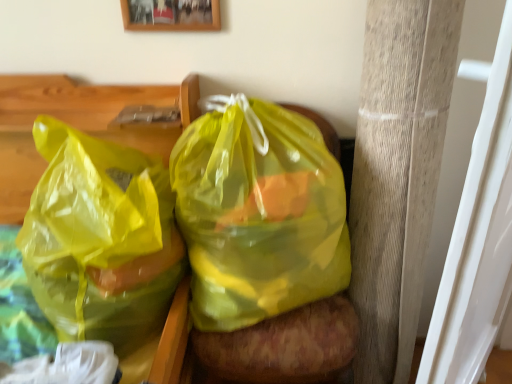
Where is `translucent yellow plastic bag at center, which appears as the 2th plastic bag when viewed from the left`? This screenshot has width=512, height=384. translucent yellow plastic bag at center, which appears as the 2th plastic bag when viewed from the left is located at coordinates (259, 215).

Is point (208, 315) behind point (155, 274)?

Yes, it is behind point (155, 274).

Looking at this image, from a real-world perspective, who is located higher, translucent yellow plastic bag at center, which appears as the 2th plastic bag when viewed from the left, or translucent yellow plastic bag at left, arranged as the first plastic bag when viewed from the left?

translucent yellow plastic bag at center, which appears as the 2th plastic bag when viewed from the left.

Is translucent yellow plastic bag at center, the 1th plastic bag viewed from the right, smaller than translucent yellow plastic bag at left, arranged as the first plastic bag when viewed from the left?

Correct, translucent yellow plastic bag at center, the 1th plastic bag viewed from the right, occupies less space than translucent yellow plastic bag at left, arranged as the first plastic bag when viewed from the left.

From the image's perspective, relative to translucent yellow plastic bag at left, arranged as the first plastic bag when viewed from the left, is translucent yellow plastic bag at center, which appears as the 2th plastic bag when viewed from the left, above or below?

From the image's perspective, translucent yellow plastic bag at center, which appears as the 2th plastic bag when viewed from the left, appears above translucent yellow plastic bag at left, arranged as the first plastic bag when viewed from the left.

Considering the relative sizes of translucent yellow plastic bag at left, positioned as the 2th plastic bag in right-to-left order, and wooden picture frame at upper center in the image provided, is translucent yellow plastic bag at left, positioned as the 2th plastic bag in right-to-left order, bigger than wooden picture frame at upper center?

Indeed, translucent yellow plastic bag at left, positioned as the 2th plastic bag in right-to-left order, has a larger size compared to wooden picture frame at upper center.

Between translucent yellow plastic bag at left, arranged as the first plastic bag when viewed from the left, and wooden picture frame at upper center, which one has more height?

translucent yellow plastic bag at left, arranged as the first plastic bag when viewed from the left.

In the scene shown: Is translucent yellow plastic bag at left, arranged as the first plastic bag when viewed from the left, wider than wooden picture frame at upper center?

Correct, the width of translucent yellow plastic bag at left, arranged as the first plastic bag when viewed from the left, exceeds that of wooden picture frame at upper center.

From the image's perspective, relative to wooden pillar at right, is translucent yellow plastic bag at center, which appears as the 2th plastic bag when viewed from the left, above or below?

Clearly, from the image's perspective, translucent yellow plastic bag at center, which appears as the 2th plastic bag when viewed from the left, is above wooden pillar at right.

Is point (344, 236) farther from viewer compared to point (429, 108)?

Yes, it is behind point (429, 108).

Is wooden pillar at right surrounded by translucent yellow plastic bag at center, which appears as the 2th plastic bag when viewed from the left?

No, wooden pillar at right is not surrounded by translucent yellow plastic bag at center, which appears as the 2th plastic bag when viewed from the left.

Based on the photo, is translucent yellow plastic bag at center, which appears as the 2th plastic bag when viewed from the left, looking in the opposite direction of wooden pillar at right?

translucent yellow plastic bag at center, which appears as the 2th plastic bag when viewed from the left, is not turned away from wooden pillar at right.

From a real-world perspective, is translucent yellow plastic bag at left, arranged as the first plastic bag when viewed from the left, physically located above or below wooden pillar at right?

translucent yellow plastic bag at left, arranged as the first plastic bag when viewed from the left, is below wooden pillar at right.

Image resolution: width=512 pixels, height=384 pixels. I want to click on pillar on the right of translucent yellow plastic bag at left, arranged as the first plastic bag when viewed from the left, so click(398, 173).

Which is behind, point (123, 339) or point (372, 7)?

The point (123, 339) is behind.

Is translucent yellow plastic bag at left, positioned as the 2th plastic bag in right-to-left order, in contact with wooden pillar at right?

No, translucent yellow plastic bag at left, positioned as the 2th plastic bag in right-to-left order, is not beside wooden pillar at right.

In the scene shown: Which is in front, translucent yellow plastic bag at left, positioned as the 2th plastic bag in right-to-left order, or translucent yellow plastic bag at center, the 1th plastic bag viewed from the right?

translucent yellow plastic bag at left, positioned as the 2th plastic bag in right-to-left order, is more forward.

Find the location of a particular element. Image resolution: width=512 pixels, height=384 pixels. plastic bag above the translucent yellow plastic bag at left, positioned as the 2th plastic bag in right-to-left order (from a real-world perspective) is located at coordinates (259, 215).

Is translucent yellow plastic bag at center, the 1th plastic bag viewed from the right, completely or partially inside translucent yellow plastic bag at left, positioned as the 2th plastic bag in right-to-left order?

No, translucent yellow plastic bag at center, the 1th plastic bag viewed from the right, is not surrounded by translucent yellow plastic bag at left, positioned as the 2th plastic bag in right-to-left order.

From the image's perspective, is translucent yellow plastic bag at left, arranged as the first plastic bag when viewed from the left, above or below translucent yellow plastic bag at center, the 1th plastic bag viewed from the right?

translucent yellow plastic bag at left, arranged as the first plastic bag when viewed from the left, is situated lower than translucent yellow plastic bag at center, the 1th plastic bag viewed from the right, in the image.

Is wooden pillar at right far away from translucent yellow plastic bag at left, positioned as the 2th plastic bag in right-to-left order?

They are positioned close to each other.

Does wooden pillar at right have a larger size compared to translucent yellow plastic bag at left, positioned as the 2th plastic bag in right-to-left order?

Actually, wooden pillar at right might be smaller than translucent yellow plastic bag at left, positioned as the 2th plastic bag in right-to-left order.

Is point (410, 59) closer to viewer compared to point (127, 152)?

That is True.

From a real-world perspective, is wooden pillar at right positioned above or below translucent yellow plastic bag at left, arranged as the first plastic bag when viewed from the left?

wooden pillar at right is situated higher than translucent yellow plastic bag at left, arranged as the first plastic bag when viewed from the left, in the real world.

What's the angular difference between wooden picture frame at upper center and wooden pillar at right's facing directions?

wooden picture frame at upper center and wooden pillar at right are facing 52.8 degrees away from each other.

Measure the distance between wooden picture frame at upper center and wooden pillar at right.

wooden picture frame at upper center is 62.47 centimeters from wooden pillar at right.

Is wooden picture frame at upper center not inside wooden pillar at right?

Absolutely, wooden picture frame at upper center is external to wooden pillar at right.

Could you tell me if wooden picture frame at upper center is turned towards wooden pillar at right?

No, wooden picture frame at upper center is not turned towards wooden pillar at right.

Identify the location of plastic bag located on the left of translucent yellow plastic bag at center, the 1th plastic bag viewed from the right. Image resolution: width=512 pixels, height=384 pixels. (100, 239).

Locate an element on the screen. picture frame behind the translucent yellow plastic bag at left, positioned as the 2th plastic bag in right-to-left order is located at coordinates (170, 15).

From the image, which object appears to be farther from wooden picture frame at upper center, wooden pillar at right or translucent yellow plastic bag at center, the 1th plastic bag viewed from the right?

The object further to wooden picture frame at upper center is wooden pillar at right.

Which object lies further to the anchor point translucent yellow plastic bag at left, arranged as the first plastic bag when viewed from the left, wooden pillar at right or wooden picture frame at upper center?

wooden pillar at right.

Estimate the real-world distances between objects in this image. Which object is further from wooden picture frame at upper center, translucent yellow plastic bag at left, arranged as the first plastic bag when viewed from the left, or wooden pillar at right?

wooden pillar at right is positioned further to the anchor wooden picture frame at upper center.

From the image, which object appears to be nearer to wooden pillar at right, wooden picture frame at upper center or translucent yellow plastic bag at left, arranged as the first plastic bag when viewed from the left?

translucent yellow plastic bag at left, arranged as the first plastic bag when viewed from the left.

Looking at the image, which one is located closer to translucent yellow plastic bag at left, positioned as the 2th plastic bag in right-to-left order, translucent yellow plastic bag at center, the 1th plastic bag viewed from the right, or wooden pillar at right?

translucent yellow plastic bag at center, the 1th plastic bag viewed from the right, lies closer to translucent yellow plastic bag at left, positioned as the 2th plastic bag in right-to-left order, than the other object.

Estimate the real-world distances between objects in this image. Which object is further from translucent yellow plastic bag at left, positioned as the 2th plastic bag in right-to-left order, translucent yellow plastic bag at center, which appears as the 2th plastic bag when viewed from the left, or wooden picture frame at upper center?

Among the two, wooden picture frame at upper center is located further to translucent yellow plastic bag at left, positioned as the 2th plastic bag in right-to-left order.

Based on their spatial positions, is wooden picture frame at upper center or translucent yellow plastic bag at center, the 1th plastic bag viewed from the right, further from translucent yellow plastic bag at left, positioned as the 2th plastic bag in right-to-left order?

wooden picture frame at upper center.

Looking at the image, which one is located further to translucent yellow plastic bag at center, the 1th plastic bag viewed from the right, wooden pillar at right or translucent yellow plastic bag at left, arranged as the first plastic bag when viewed from the left?

Among the two, wooden pillar at right is located further to translucent yellow plastic bag at center, the 1th plastic bag viewed from the right.

This screenshot has width=512, height=384. I want to click on plastic bag between wooden picture frame at upper center and wooden pillar at right, so click(259, 215).

At what (x,y) coordinates should I click in order to perform the action: click on picture frame situated between translucent yellow plastic bag at left, arranged as the first plastic bag when viewed from the left, and wooden pillar at right from left to right. Please return your answer as a coordinate pair (x, y). Looking at the image, I should click on (170, 15).

Locate an element on the screen. plastic bag between wooden picture frame at upper center and translucent yellow plastic bag at left, positioned as the 2th plastic bag in right-to-left order, in the up-down direction is located at coordinates (259, 215).

Where is `plastic bag situated between translucent yellow plastic bag at left, positioned as the 2th plastic bag in right-to-left order, and wooden pillar at right from left to right`? The height and width of the screenshot is (384, 512). plastic bag situated between translucent yellow plastic bag at left, positioned as the 2th plastic bag in right-to-left order, and wooden pillar at right from left to right is located at coordinates (259, 215).